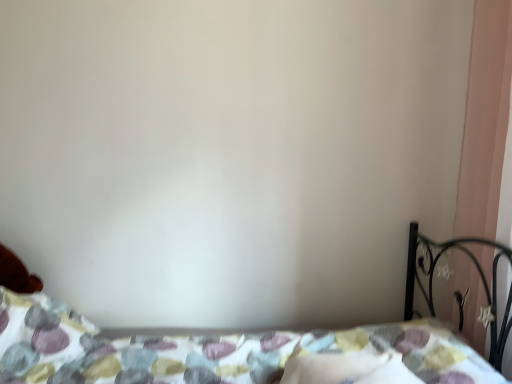
Question: Does pink matte curtain at right have a larger size compared to patterned fabric bed at lower center?

Choices:
 (A) no
 (B) yes

Answer: (A)

Question: Does pink matte curtain at right have a smaller size compared to patterned fabric bed at lower center?

Choices:
 (A) no
 (B) yes

Answer: (B)

Question: Is pink matte curtain at right outside patterned fabric bed at lower center?

Choices:
 (A) no
 (B) yes

Answer: (B)

Question: From the image's perspective, is pink matte curtain at right located above patterned fabric bed at lower center?

Choices:
 (A) yes
 (B) no

Answer: (A)

Question: Is pink matte curtain at right to the left of patterned fabric bed at lower center from the viewer's perspective?

Choices:
 (A) yes
 (B) no

Answer: (B)

Question: In terms of height, does patterned fabric bed at lower center look taller or shorter compared to pink matte curtain at right?

Choices:
 (A) short
 (B) tall

Answer: (A)

Question: Is patterned fabric bed at lower center to the left or to the right of pink matte curtain at right in the image?

Choices:
 (A) right
 (B) left

Answer: (B)

Question: From the image's perspective, relative to pink matte curtain at right, is patterned fabric bed at lower center above or below?

Choices:
 (A) below
 (B) above

Answer: (A)

Question: In terms of width, does patterned fabric bed at lower center look wider or thinner when compared to pink matte curtain at right?

Choices:
 (A) wide
 (B) thin

Answer: (A)

Question: Is pink matte curtain at right spatially inside patterned fabric bed at lower center, or outside of it?

Choices:
 (A) inside
 (B) outside

Answer: (B)

Question: From a real-world perspective, relative to patterned fabric bed at lower center, is pink matte curtain at right vertically above or below?

Choices:
 (A) above
 (B) below

Answer: (A)

Question: Is pink matte curtain at right in front of or behind patterned fabric bed at lower center in the image?

Choices:
 (A) front
 (B) behind

Answer: (B)

Question: Is pink matte curtain at right to the left or to the right of patterned fabric bed at lower center in the image?

Choices:
 (A) right
 (B) left

Answer: (A)

Question: Is patterned fabric bed at lower center in front of or behind white soft pillow at lower center in the image?

Choices:
 (A) front
 (B) behind

Answer: (A)

Question: Looking at their shapes, would you say patterned fabric bed at lower center is wider or thinner than white soft pillow at lower center?

Choices:
 (A) thin
 (B) wide

Answer: (B)